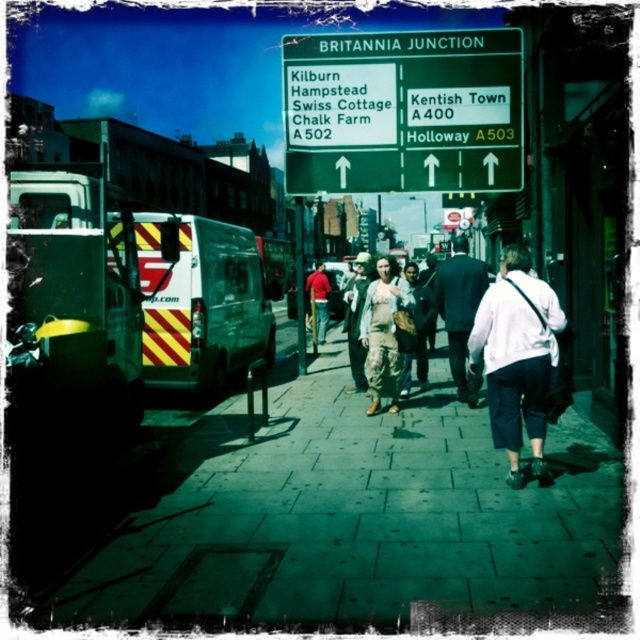
Who is taller, green metallic signboard at upper center or red shirt at center?

Standing taller between the two is red shirt at center.

You are a GUI agent. You are given a task and a screenshot of the screen. Output one action in this format:
    pyautogui.click(x=<x>, y=<y>)
    Task: Click on the green metallic signboard at upper center
    Image resolution: width=640 pixels, height=640 pixels.
    Given the screenshot: What is the action you would take?
    pyautogui.click(x=403, y=112)

Is point (397, 429) closer to camera compared to point (508, 364)?

No, (397, 429) is further to viewer.

Where is `green stone pavement at center`? green stone pavement at center is located at coordinates (348, 515).

The image size is (640, 640). Find the location of `green stone pavement at center`. green stone pavement at center is located at coordinates (348, 515).

Identify the location of green stone pavement at center. (348, 515).

Which is in front, point (532, 442) or point (465, 340)?

Point (532, 442)

What do you see at coordinates (516, 358) in the screenshot? Image resolution: width=640 pixels, height=640 pixels. I see `white fabric bag at center` at bounding box center [516, 358].

Image resolution: width=640 pixels, height=640 pixels. What do you see at coordinates (516, 358) in the screenshot?
I see `white fabric bag at center` at bounding box center [516, 358].

Where is `white fabric bag at center`? This screenshot has width=640, height=640. white fabric bag at center is located at coordinates (516, 358).